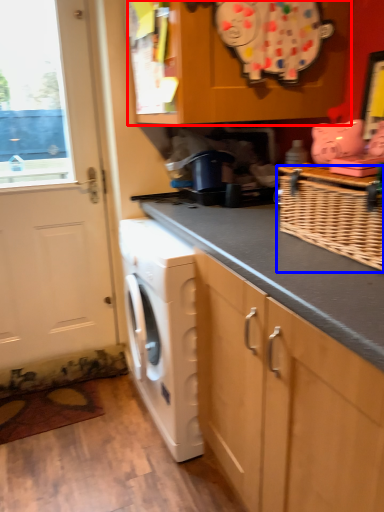
Question: Which point is closer to the camera, cabinetry (highlighted by a red box) or basket (highlighted by a blue box)?

Choices:
 (A) cabinetry
 (B) basket

Answer: (B)